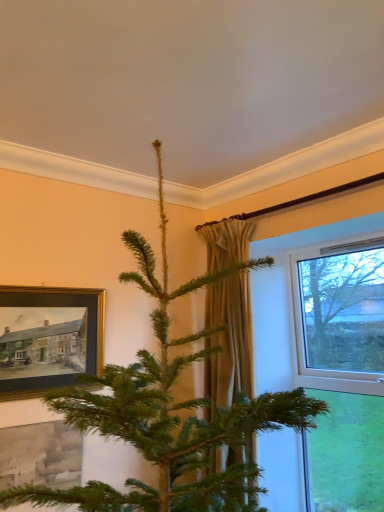
Question: Would you say beige fabric curtain at center is to the left or to the right of gold-framed painting at left in the picture?

Choices:
 (A) right
 (B) left

Answer: (A)

Question: Is beige fabric curtain at center taller or shorter than gold-framed painting at left?

Choices:
 (A) tall
 (B) short

Answer: (A)

Question: Estimate the real-world distances between objects in this image. Which object is closer to the gold-framed painting at left?

Choices:
 (A) clear glass window at right
 (B) beige fabric curtain at center
 (C) green matte christmas tree at center

Answer: (C)

Question: Which object is the closest to the gold-framed painting at left?

Choices:
 (A) clear glass window at right
 (B) beige fabric curtain at center
 (C) green matte christmas tree at center

Answer: (C)